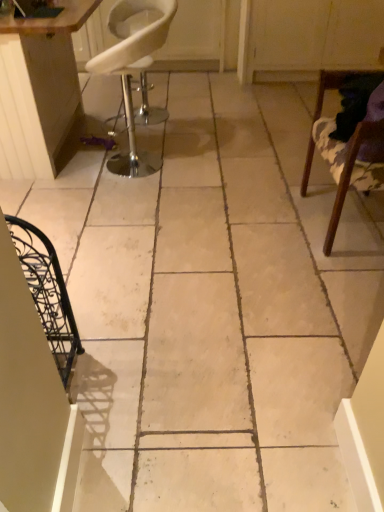
You are a GUI agent. You are given a task and a screenshot of the screen. Output one action in this format:
    pyautogui.click(x=<x>, y=<y>)
    Task: Click on the vacant region below wooden chair at right, which ranks as the second chair in left-to-right order (from a real-world perspective)
    This screenshot has height=512, width=384.
    Given the screenshot: What is the action you would take?
    pyautogui.click(x=344, y=224)